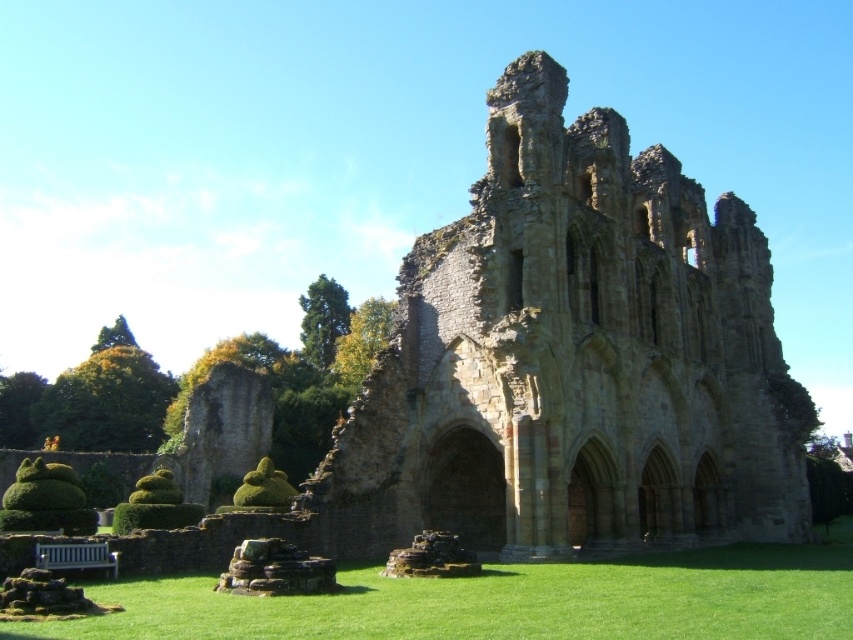
Looking at this image, who is higher up, brown stone ruins at center or green grass at lower center?

Positioned higher is brown stone ruins at center.

Can you confirm if brown stone ruins at center is smaller than green grass at lower center?

No.

Is point (540, 116) in front of point (310, 636)?

No, it is behind (310, 636).

Identify the location of brown stone ruins at center. (573, 362).

In the scene shown: Does green grass at lower center come in front of white wooden bench at lower left?

Yes, green grass at lower center is in front of white wooden bench at lower left.

Does point (782, 611) come farther from viewer compared to point (90, 566)?

No.

Between point (437, 604) and point (114, 563), which one is positioned behind?

Positioned behind is point (114, 563).

You are a GUI agent. You are given a task and a screenshot of the screen. Output one action in this format:
    pyautogui.click(x=<x>, y=<y>)
    Task: Click on the green grass at lower center
    
    Given the screenshot: What is the action you would take?
    pyautogui.click(x=511, y=600)

Who is positioned more to the left, brown stone ruins at center or green leafy hedge at left?

green leafy hedge at left

Which of these two, brown stone ruins at center or green leafy hedge at left, stands shorter?

With less height is green leafy hedge at left.

Does point (531, 424) lie behind point (70, 381)?

No, it is in front of (70, 381).

Where is `brown stone ruins at center`? The width and height of the screenshot is (853, 640). brown stone ruins at center is located at coordinates (573, 362).